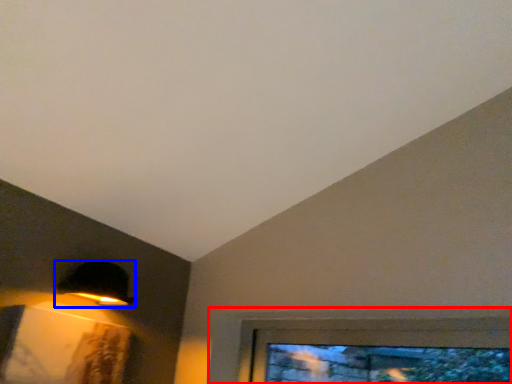
Question: Which object appears farthest to the camera in this image, window (highlighted by a red box) or lamp (highlighted by a blue box)?

Choices:
 (A) window
 (B) lamp

Answer: (B)